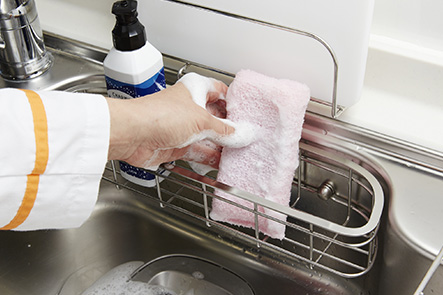
The image size is (443, 295). I want to click on sink, so click(x=136, y=239).